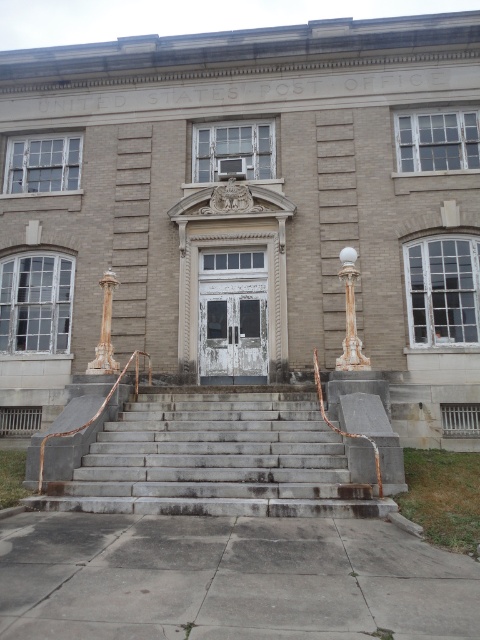
You are a postal worker who needs to hang a new sign above the entrance. The sign requires a support structure that must be attached to the taller column. Which column should you choose between the white marble column at center and the marble column at left?

The white marble column at center is taller than the marble column at left, so you should choose the white marble column at center to attach the support structure for the new sign.

You are a delivery person approaching the United States Post Office building. You need to place a package on the gray concrete stairs at center and the marble column at left. Which object should you choose if you want to place the package at a lower height?

The gray concrete stairs at center is shorter than the marble column at left, so you should place the package on the gray concrete stairs at center to have it at a lower height.

You are standing in front of the Post Office building and need to enter through the main entrance. Which object, the gray concrete stairs at center or the white marble column at center, must you go around to reach the entrance?

The gray concrete stairs at center is in front of the white marble column at center, so you must go around the gray concrete stairs at center to reach the entrance.